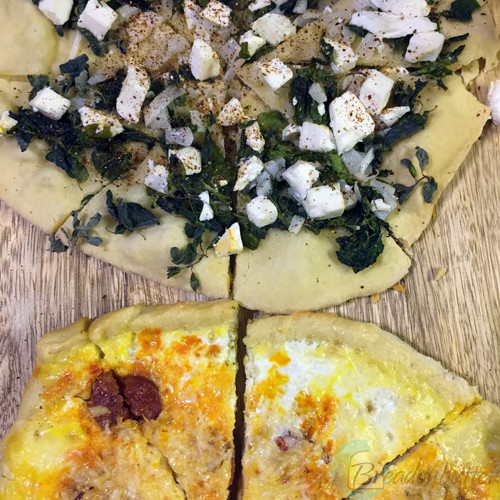
The image size is (500, 500). In order to click on table in middle right side of pizzas in this screenshot , I will do `click(449, 302)`.